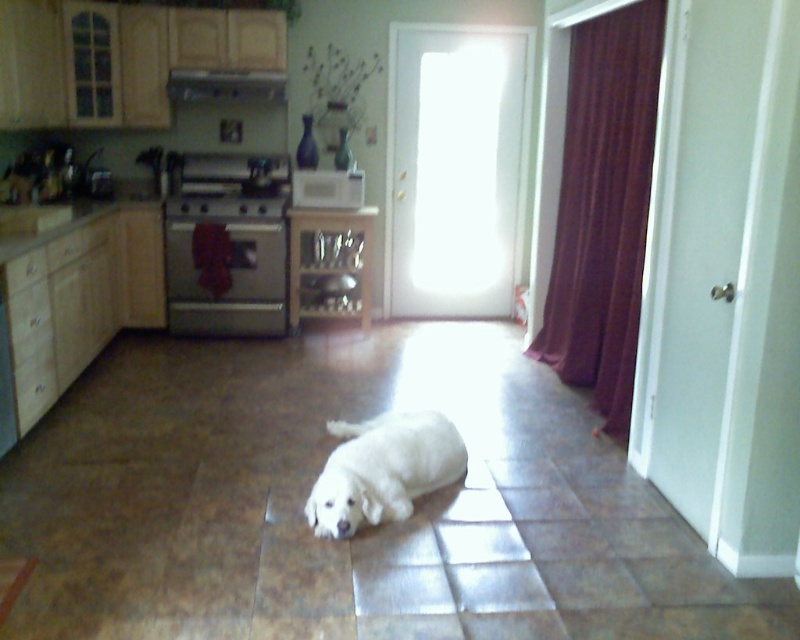
You are standing in the kitchen and want to reach both the point at coordinates (272, 289) and the point at coordinates (332, 502). Which point will you reach first?

You will reach the point at coordinates (272, 289) first because it is closer to you than the point at coordinates (332, 502), which is further away.